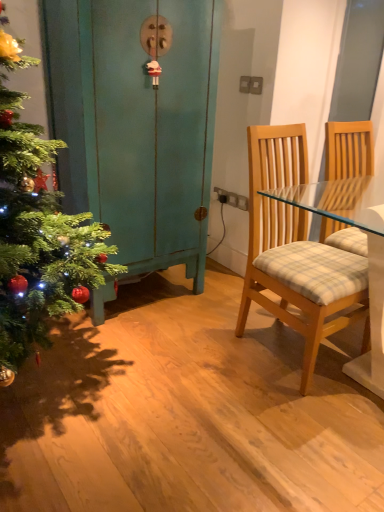
Locate an element on the screen. This screenshot has height=512, width=384. vacant area situated to the left side of light wood/glass chair at right is located at coordinates (196, 351).